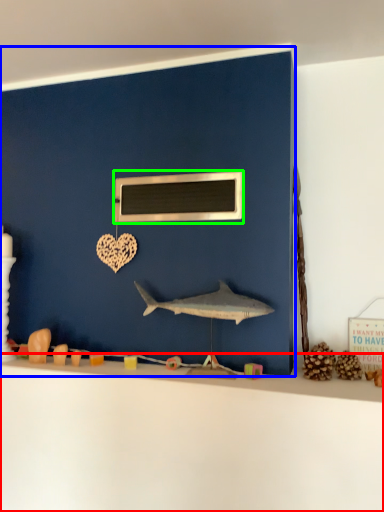
Question: Considering the real-world distances, which object is closest to counter top (highlighted by a red box)? backdrop (highlighted by a blue box) or medicine cabinet (highlighted by a green box).

Choices:
 (A) backdrop
 (B) medicine cabinet

Answer: (A)